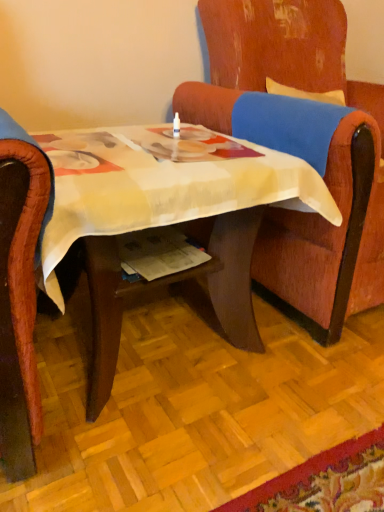
Question: Is wooden chair at center to the left or to the right of wooden desk at center in the image?

Choices:
 (A) right
 (B) left

Answer: (A)

Question: Considering their positions, is wooden chair at center located in front of or behind wooden desk at center?

Choices:
 (A) behind
 (B) front

Answer: (A)

Question: Is point (274, 243) closer or farther from the camera than point (198, 163)?

Choices:
 (A) closer
 (B) farther

Answer: (B)

Question: In terms of height, does wooden desk at center look taller or shorter compared to wooden chair at center?

Choices:
 (A) short
 (B) tall

Answer: (A)

Question: Considering their positions, is wooden desk at center located in front of or behind wooden chair at center?

Choices:
 (A) behind
 (B) front

Answer: (B)

Question: Considering the positions of wooden desk at center and wooden chair at center in the image, is wooden desk at center bigger or smaller than wooden chair at center?

Choices:
 (A) small
 (B) big

Answer: (A)

Question: In terms of width, does wooden desk at center look wider or thinner when compared to wooden chair at center?

Choices:
 (A) thin
 (B) wide

Answer: (A)